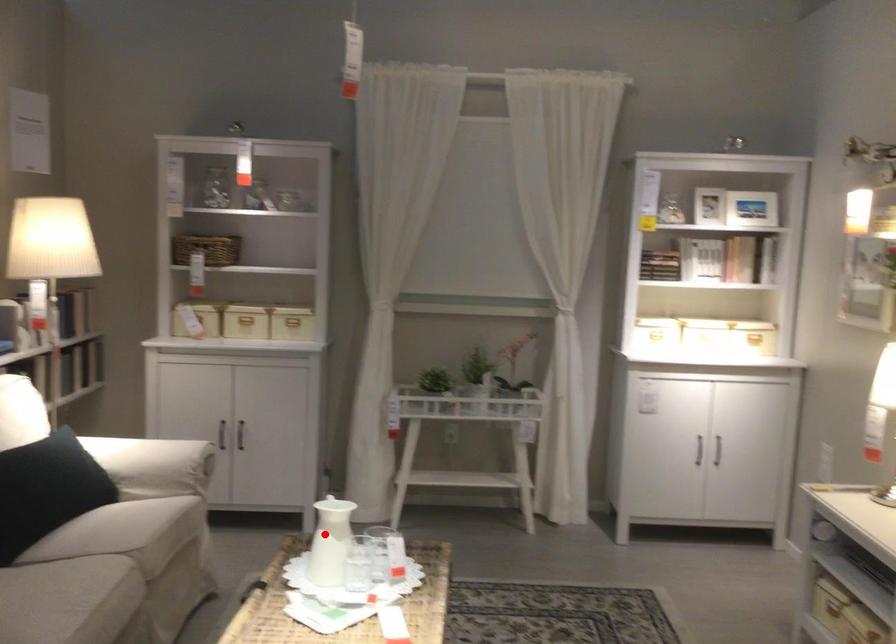
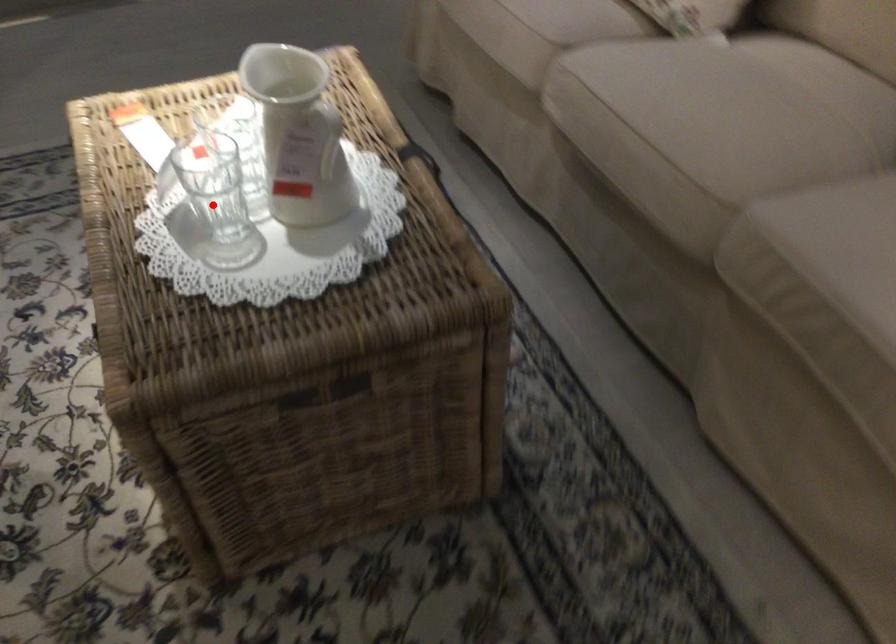
I am providing you with two images of the same scene from different viewpoints. A red point is marked on the first image and another point is marked on the second image. Are the points marked in image1 and image2 representing the same 3D position?

No